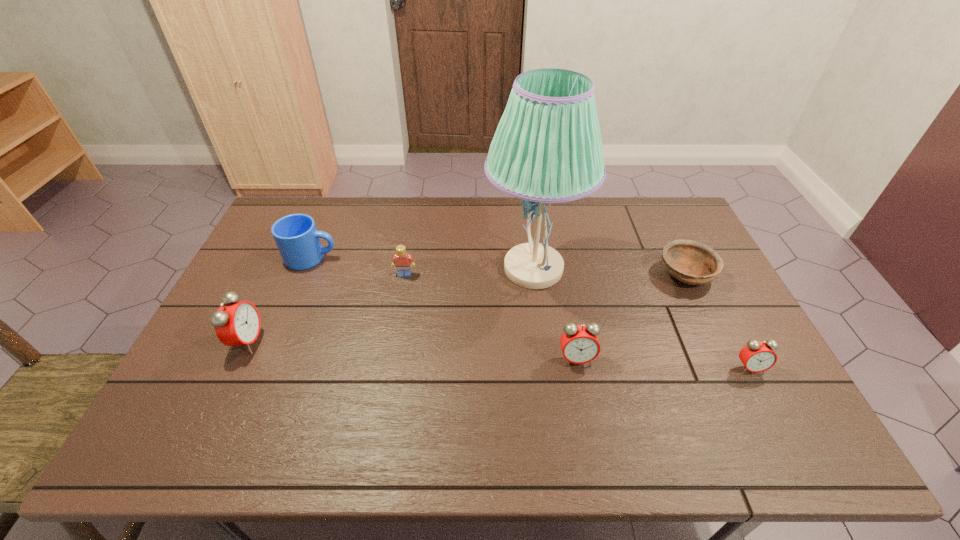
Image resolution: width=960 pixels, height=540 pixels. I want to click on free space between the tallest object and the tallest alarm clock, so click(x=391, y=305).

I want to click on free space between the leftmost alarm clock and the mug, so click(279, 299).

I want to click on empty location between the shortest object and the shortest alarm clock, so click(717, 321).

This screenshot has height=540, width=960. I want to click on unoccupied position between the tallest alarm clock and the mug, so pyautogui.click(x=279, y=299).

Select which object appears as the fourth closest to the mug. Please provide its 2D coordinates. Your answer should be formatted as a tuple, i.e. [(x, y)], where the tuple contains the x and y coordinates of a point satisfying the conditions above.

[(579, 344)]

The image size is (960, 540). Find the location of `the fourth closest object to the second alarm clock from left to right`. the fourth closest object to the second alarm clock from left to right is located at coordinates (401, 260).

Locate which alarm clock is the closest to the tallest alarm clock. Please provide its 2D coordinates. Your answer should be formatted as a tuple, i.e. [(x, y)], where the tuple contains the x and y coordinates of a point satisfying the conditions above.

[(579, 344)]

Choose which alarm clock is the second nearest neighbor to the tallest alarm clock. Please provide its 2D coordinates. Your answer should be formatted as a tuple, i.e. [(x, y)], where the tuple contains the x and y coordinates of a point satisfying the conditions above.

[(757, 356)]

What are the coordinates of `vacant region that satisfies the following two spatial constraints: 1. on the side of the mug with the handle; 2. on the left side of the shortest object` in the screenshot? It's located at (304, 274).

At what (x,y) coordinates should I click in order to perform the action: click on vacant space that satisfies the following two spatial constraints: 1. on the front-facing side of the Lego; 2. on the front-facing side of the leftmost alarm clock. Please return your answer as a coordinate pair (x, y). Looking at the image, I should click on (393, 341).